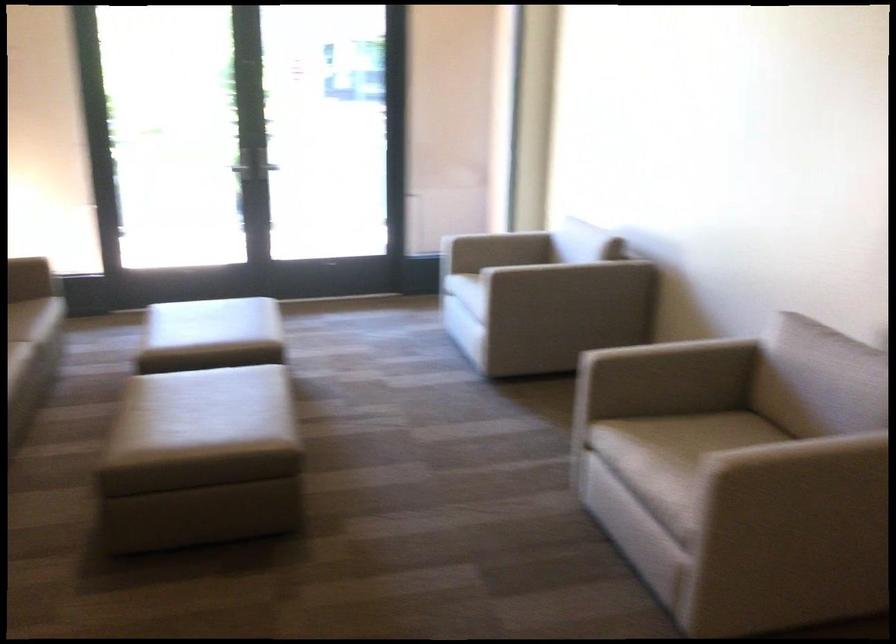
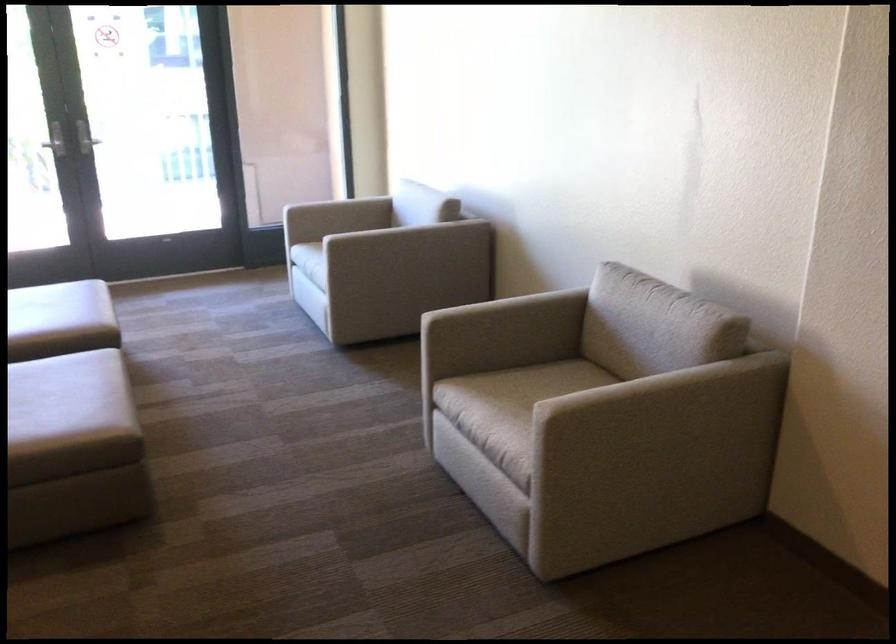
In the second image, find the point that corresponds to point 677,438 in the first image.

(513, 389)